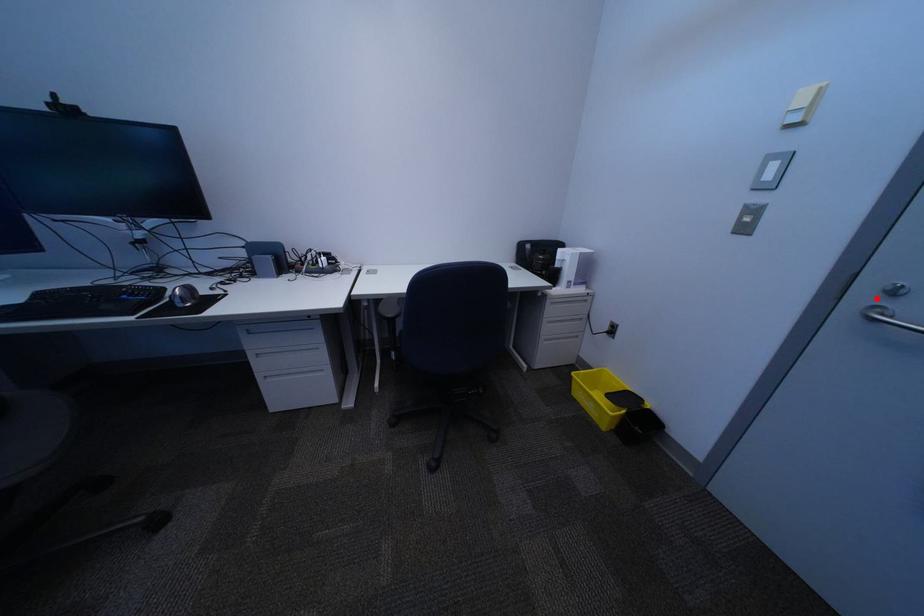
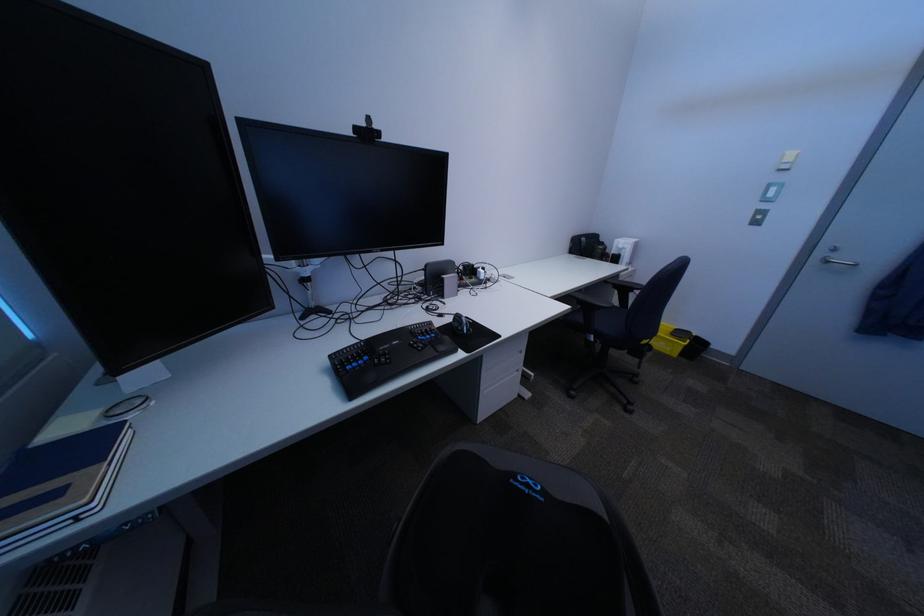
Question: I am providing you with two images of the same scene from different viewpoints. A red point is shown in image1. For the corresponding object point in image2, is it positioned nearer or farther from the camera?

Choices:
 (A) Nearer
 (B) Farther

Answer: (B)